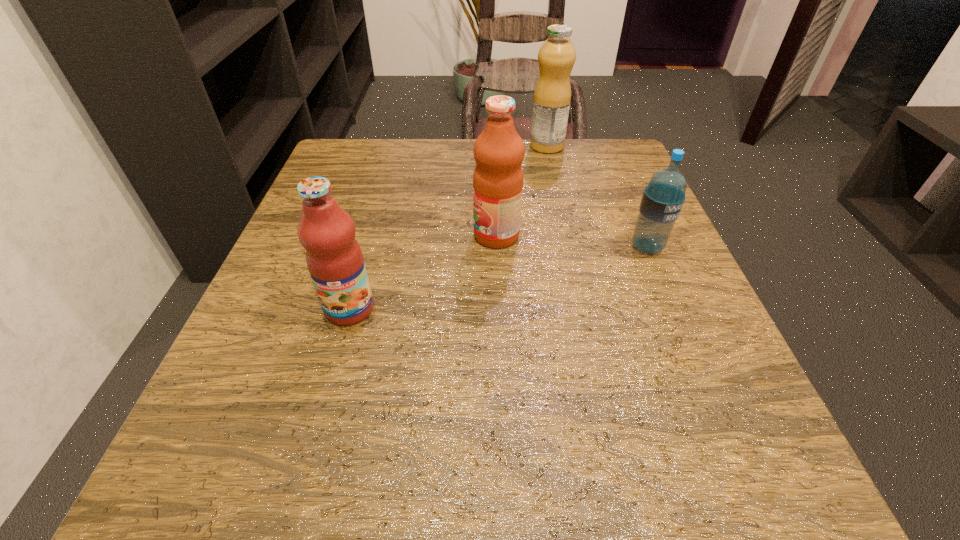
You are a GUI agent. You are given a task and a screenshot of the screen. Output one action in this format:
    pyautogui.click(x=<x>, y=<y>)
    Task: Click on the vacant point that satisfies the following two spatial constraints: 1. on the front label of the second object from right to left; 2. on the front label of the leftmost fruit juice
    This screenshot has width=960, height=540.
    Given the screenshot: What is the action you would take?
    [584, 309]